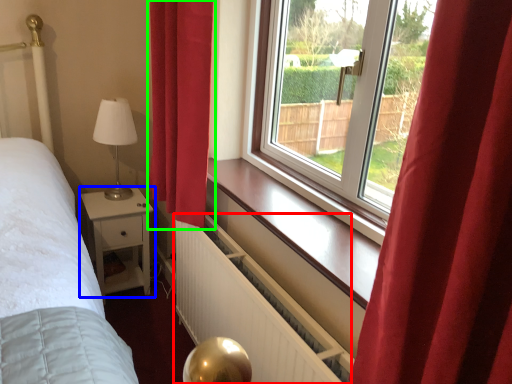
Question: Considering the real-world distances, which object is closest to radiator (highlighted by a red box)? nightstand (highlighted by a blue box) or curtain (highlighted by a green box).

Choices:
 (A) nightstand
 (B) curtain

Answer: (B)